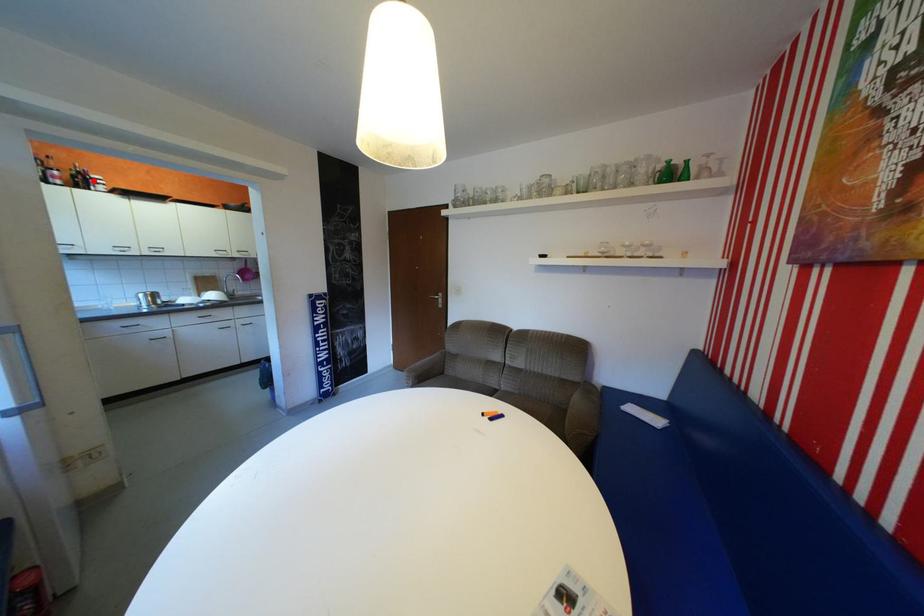
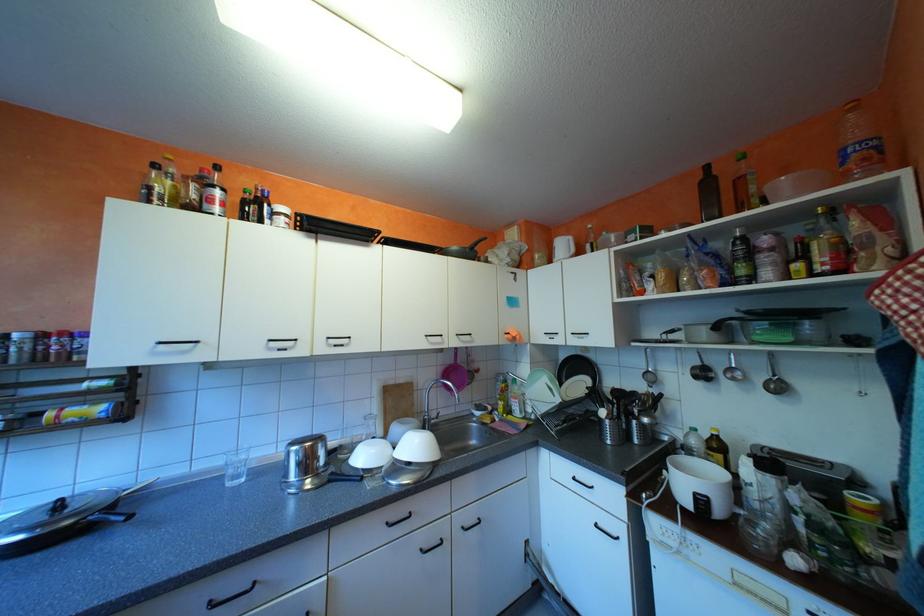
Where in the second image is the point corresponding to the highlighted location from the first image?

(263, 208)